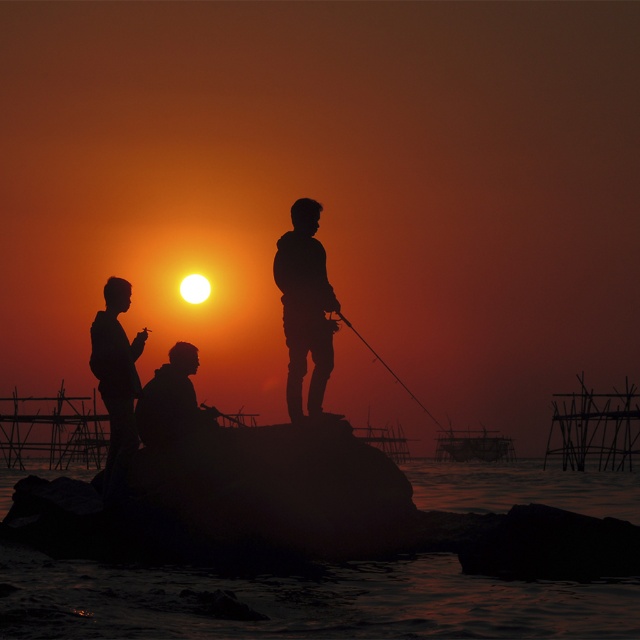
Question: Which of these objects is positioned closest to the silhouette figure at center?

Choices:
 (A) dark water at center
 (B) silhouette figure at left
 (C) silvery metallic fishing pole at center

Answer: (C)

Question: Considering the real-world distances, which object is closest to the silhouette figure at left?

Choices:
 (A) silhouette figure at center
 (B) dark water at center

Answer: (A)

Question: Is silhouette figure at center above silvery metallic fishing pole at center?

Choices:
 (A) no
 (B) yes

Answer: (B)

Question: Which of the following is the closest to the observer?

Choices:
 (A) silhouette figure at left
 (B) silvery metallic fishing pole at center
 (C) dark water at center

Answer: (C)

Question: Can you confirm if silhouette figure at center is wider than silhouette figure at left?

Choices:
 (A) yes
 (B) no

Answer: (A)

Question: Is dark water at center smaller than silhouette figure at left?

Choices:
 (A) no
 (B) yes

Answer: (A)